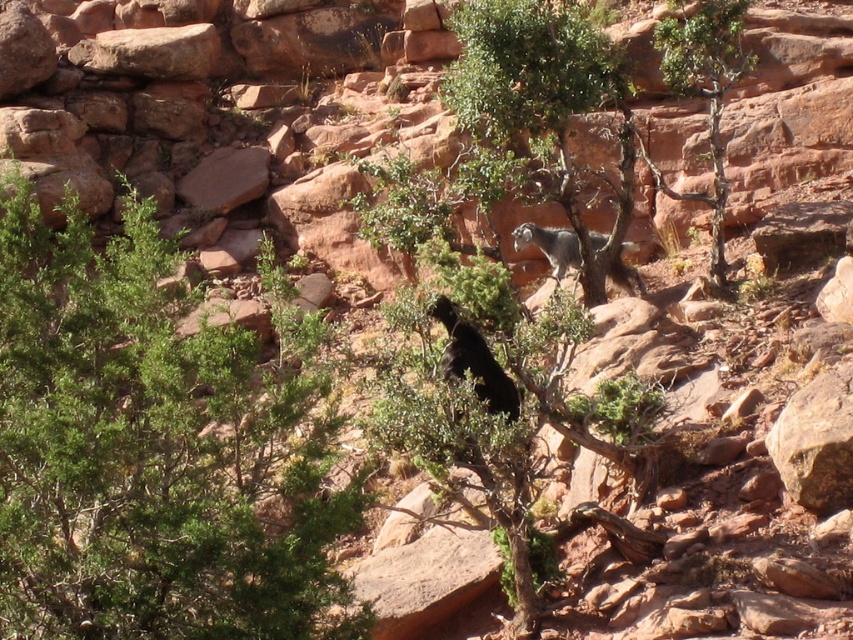
Question: Does green leafy tree at center appear over green leafy tree at upper right?

Choices:
 (A) yes
 (B) no

Answer: (B)

Question: Where is green leafy shrub at left located in relation to green leafy tree at upper right in the image?

Choices:
 (A) above
 (B) below

Answer: (B)

Question: Which point is closer to the camera?

Choices:
 (A) (712, 250)
 (B) (515, 410)

Answer: (B)

Question: Among these objects, which one is nearest to the camera?

Choices:
 (A) green leafy tree at upper right
 (B) black furry animal at center
 (C) gray furry goat at center

Answer: (B)

Question: Which object is the closest to the green leafy shrub at center?

Choices:
 (A) green leafy tree at center
 (B) green leafy tree at upper right
 (C) black furry animal at center

Answer: (C)

Question: Is green leafy tree at upper right smaller than black furry animal at center?

Choices:
 (A) yes
 (B) no

Answer: (B)